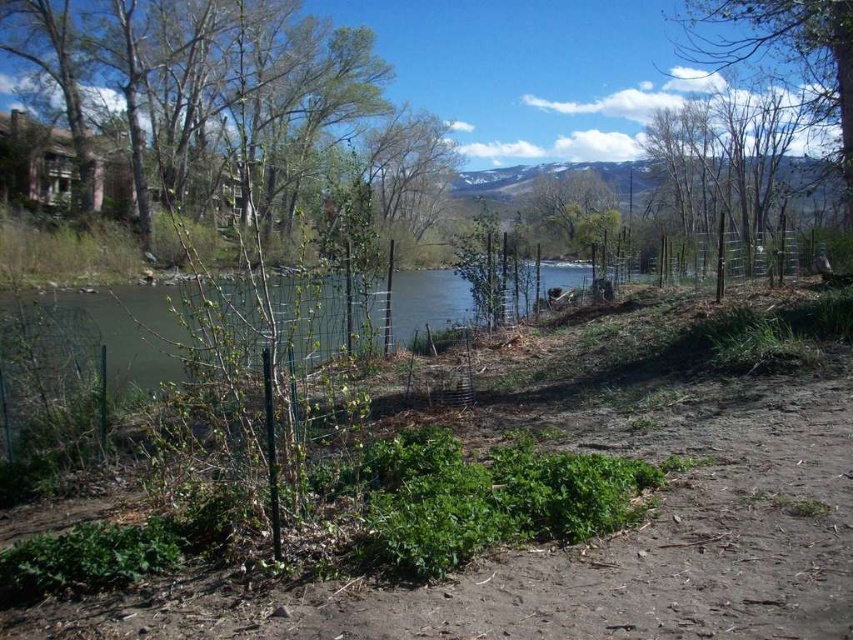
Question: Estimate the real-world distances between objects in this image. Which object is farther from the green leafy tree at upper right?

Choices:
 (A) green leafy tree at upper left
 (B) green leafy tree at center

Answer: (A)

Question: Which of the following is the closest to the observer?

Choices:
 (A) (813, 86)
 (B) (222, 83)
 (C) (577, 186)

Answer: (A)

Question: Is green leafy tree at upper left bigger than green leafy tree at center?

Choices:
 (A) yes
 (B) no

Answer: (A)

Question: Is green leafy tree at upper left closer to the viewer compared to green leafy tree at upper right?

Choices:
 (A) no
 (B) yes

Answer: (B)

Question: From the image, what is the correct spatial relationship of green leafy tree at upper right in relation to green leafy tree at center?

Choices:
 (A) below
 (B) above

Answer: (B)

Question: Which object appears closest to the camera in this image?

Choices:
 (A) green leafy tree at upper right
 (B) green leafy tree at upper left

Answer: (B)